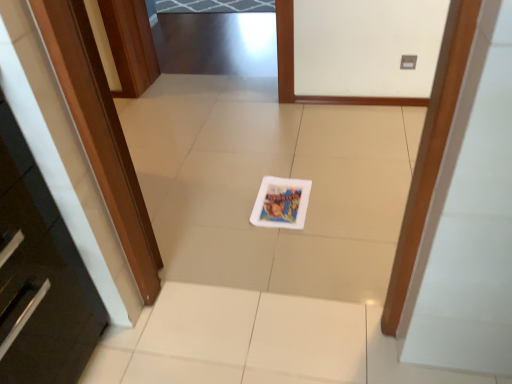
You are a GUI agent. You are given a task and a screenshot of the screen. Output one action in this format:
    pyautogui.click(x=<x>, y=<y>)
    Task: Click on the vacant region above white glossy postcard at center (from a real-world perspective)
    This screenshot has width=512, height=384.
    Given the screenshot: What is the action you would take?
    pyautogui.click(x=284, y=201)